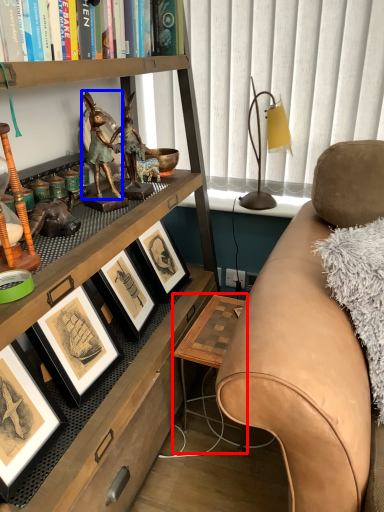
Question: Which object appears closest to the camera in this image, table (highlighted by a red box) or person (highlighted by a blue box)?

Choices:
 (A) table
 (B) person

Answer: (B)